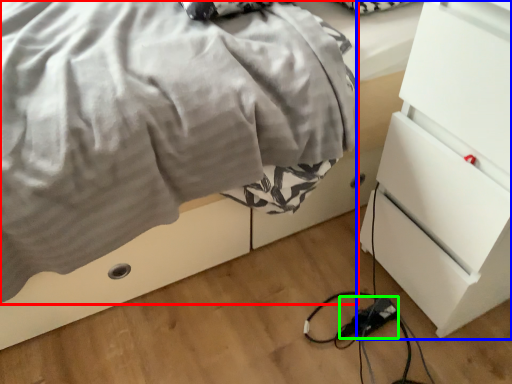
Question: Which is nearer to the blanket (highlighted by a red box)? chest of drawers (highlighted by a blue box) or extension cord (highlighted by a green box).

Choices:
 (A) chest of drawers
 (B) extension cord

Answer: (A)